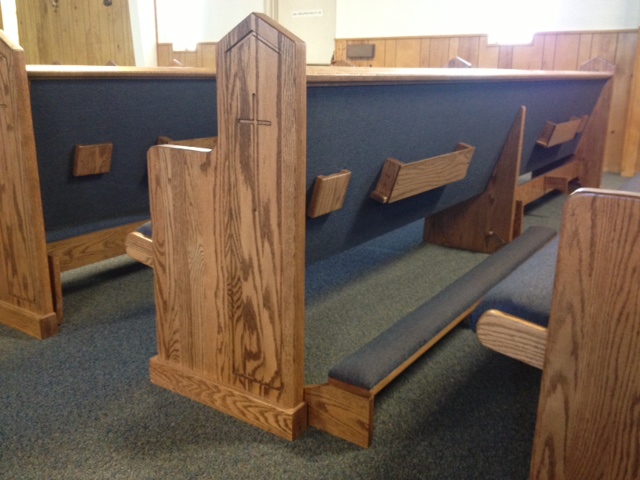
Where is `wooden church pew ends`? The height and width of the screenshot is (480, 640). wooden church pew ends is located at coordinates (228, 281), (621, 350), (22, 218).